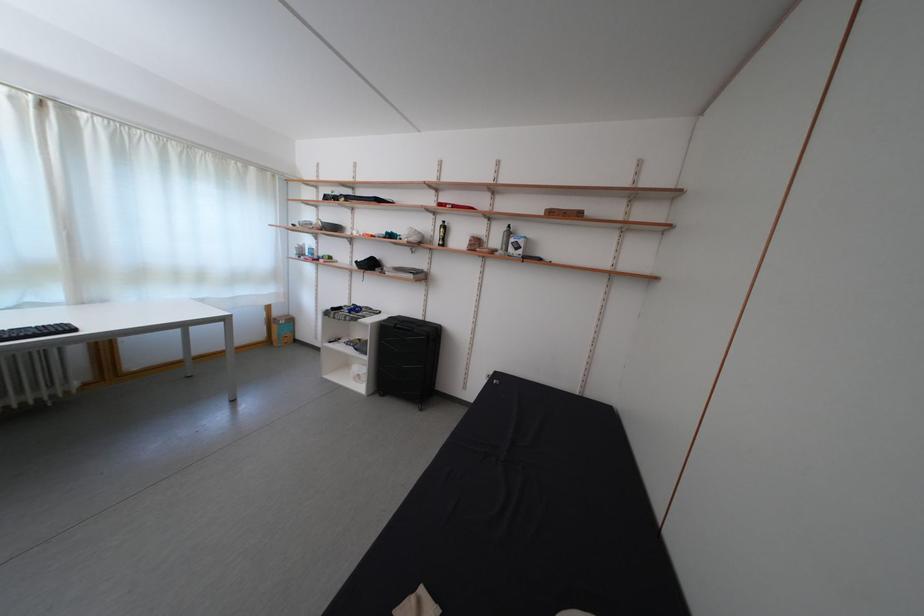
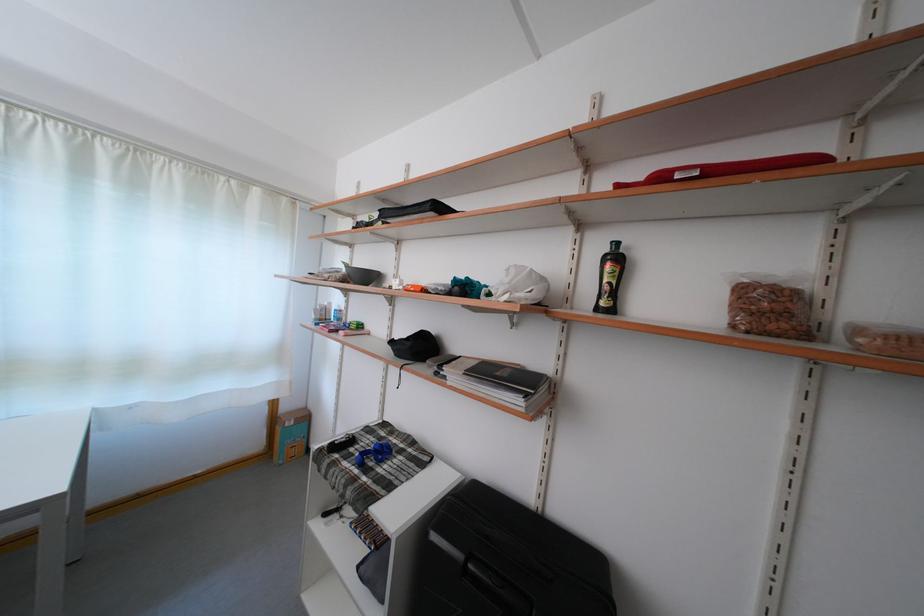
Locate, in the second image, the point that corresponds to point 485,252 in the first image.

(782, 321)